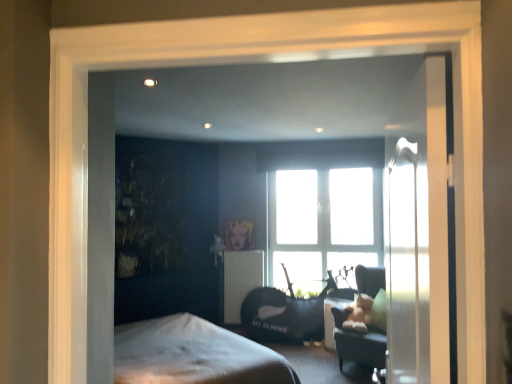
What is the approximate width of velvet black swivel chair at center, acting as the 1th swivel chair starting from the back?

velvet black swivel chair at center, acting as the 1th swivel chair starting from the back, is 24.85 centimeters wide.

Image resolution: width=512 pixels, height=384 pixels. Identify the location of clear glass door at right. (420, 239).

Locate an element on the screen. The image size is (512, 384). white textured radiator at center is located at coordinates (241, 280).

Identify the location of velvet dark gray swivel chair at center, which ranks as the first swivel chair in front-to-back order. This screenshot has height=384, width=512. (359, 346).

Is matte black table at lower center surrounded by velvet dark gray swivel chair at center, which ranks as the first swivel chair in front-to-back order?

That's incorrect, matte black table at lower center is not inside velvet dark gray swivel chair at center, which ranks as the first swivel chair in front-to-back order.

Looking at this image, is velvet dark gray swivel chair at center, positioned as the second swivel chair in back-to-front order, oriented away from matte black table at lower center?

velvet dark gray swivel chair at center, positioned as the second swivel chair in back-to-front order, is not turned away from matte black table at lower center.

Based on the photo, is velvet dark gray swivel chair at center, positioned as the second swivel chair in back-to-front order, to the left or to the right of matte black table at lower center in the image?

In the image, velvet dark gray swivel chair at center, positioned as the second swivel chair in back-to-front order, appears on the right side of matte black table at lower center.

Are velvet dark gray swivel chair at center, which ranks as the first swivel chair in front-to-back order, and matte black table at lower center beside each other?

No, velvet dark gray swivel chair at center, which ranks as the first swivel chair in front-to-back order, is not making contact with matte black table at lower center.

Between velvet black swivel chair at center, the second swivel chair viewed from the front, and metallic gold picture frame at center, which one has more height?

Standing taller between the two is velvet black swivel chair at center, the second swivel chair viewed from the front.

From a real-world perspective, is velvet black swivel chair at center, acting as the 1th swivel chair starting from the back, positioned over metallic gold picture frame at center based on gravity?

No, from a real-world perspective, velvet black swivel chair at center, acting as the 1th swivel chair starting from the back, is not on top of metallic gold picture frame at center.

Would you consider velvet black swivel chair at center, the second swivel chair viewed from the front, to be distant from metallic gold picture frame at center?

No, there isn't a large distance between velvet black swivel chair at center, the second swivel chair viewed from the front, and metallic gold picture frame at center.

From the image's perspective, is white textured radiator at center located above matte black table at lower center?

Yes.

How much distance is there between white textured radiator at center and matte black table at lower center?

They are 1.24 meters apart.

Looking at this image, from a real-world perspective, who is located higher, white textured radiator at center or matte black table at lower center?

white textured radiator at center, from a real-world perspective.

Which object is wider, matte black table at lower center or metallic gold picture frame at center?

With larger width is matte black table at lower center.

Would you say matte black table at lower center is a long distance from metallic gold picture frame at center?

Yes, matte black table at lower center and metallic gold picture frame at center are located far from each other.

Could metallic gold picture frame at center be considered to be inside matte black table at lower center?

No, metallic gold picture frame at center is located outside of matte black table at lower center.

From the image's perspective, is matte black table at lower center above metallic gold picture frame at center?

No, from the image's perspective, matte black table at lower center is not on top of metallic gold picture frame at center.

How different are the orientations of velvet black swivel chair at center, acting as the 1th swivel chair starting from the back, and clear glass door at right in degrees?

98 degrees.

Is point (313, 303) farther from viewer compared to point (426, 273)?

Yes.

Consider the image. Would you say velvet black swivel chair at center, acting as the 1th swivel chair starting from the back, is to the left or to the right of clear glass door at right in the picture?

Clearly, velvet black swivel chair at center, acting as the 1th swivel chair starting from the back, is on the right of clear glass door at right in the image.

From the image's perspective, which object appears higher, metallic gold picture frame at center or velvet black swivel chair at center, the second swivel chair viewed from the front?

metallic gold picture frame at center is shown above in the image.

Which is more to the right, metallic gold picture frame at center or velvet black swivel chair at center, acting as the 1th swivel chair starting from the back?

Positioned to the right is velvet black swivel chair at center, acting as the 1th swivel chair starting from the back.

Is metallic gold picture frame at center completely or partially outside of velvet black swivel chair at center, the second swivel chair viewed from the front?

Indeed, metallic gold picture frame at center is completely outside velvet black swivel chair at center, the second swivel chair viewed from the front.

Is metallic gold picture frame at center not near velvet black swivel chair at center, the second swivel chair viewed from the front?

No, metallic gold picture frame at center is not far away from velvet black swivel chair at center, the second swivel chair viewed from the front.

Can you confirm if velvet black swivel chair at center, acting as the 1th swivel chair starting from the back, is thinner than velvet dark gray swivel chair at center, positioned as the second swivel chair in back-to-front order?

Indeed, velvet black swivel chair at center, acting as the 1th swivel chair starting from the back, has a lesser width compared to velvet dark gray swivel chair at center, positioned as the second swivel chair in back-to-front order.

Does velvet black swivel chair at center, the second swivel chair viewed from the front, touch velvet dark gray swivel chair at center, positioned as the second swivel chair in back-to-front order?

No, velvet black swivel chair at center, the second swivel chair viewed from the front, is not next to velvet dark gray swivel chair at center, positioned as the second swivel chair in back-to-front order.

Could you tell me if velvet black swivel chair at center, acting as the 1th swivel chair starting from the back, is facing velvet dark gray swivel chair at center, which ranks as the first swivel chair in front-to-back order?

Yes.

Would you say velvet black swivel chair at center, the second swivel chair viewed from the front, is to the left or to the right of velvet dark gray swivel chair at center, which ranks as the first swivel chair in front-to-back order, in the picture?

velvet black swivel chair at center, the second swivel chair viewed from the front, is positioned on velvet dark gray swivel chair at center, which ranks as the first swivel chair in front-to-back order,'s left side.

Image resolution: width=512 pixels, height=384 pixels. I want to click on table behind the velvet dark gray swivel chair at center, which ranks as the first swivel chair in front-to-back order, so click(332, 319).

This screenshot has height=384, width=512. I want to click on the 1st swivel chair in front of the metallic gold picture frame at center, so click(287, 314).

Looking at the image, which one is located further to velvet dark gray swivel chair at center, positioned as the second swivel chair in back-to-front order, transparent glass window at center or metallic gold picture frame at center?

Based on the image, metallic gold picture frame at center appears to be further to velvet dark gray swivel chair at center, positioned as the second swivel chair in back-to-front order.

Considering their positions, is matte black table at lower center positioned closer to velvet dark gray swivel chair at center, which ranks as the first swivel chair in front-to-back order, than velvet black swivel chair at center, the second swivel chair viewed from the front?

matte black table at lower center.

Considering their positions, is metallic gold picture frame at center positioned closer to velvet dark gray swivel chair at center, which ranks as the first swivel chair in front-to-back order, than clear glass door at right?

The object closer to velvet dark gray swivel chair at center, which ranks as the first swivel chair in front-to-back order, is metallic gold picture frame at center.

Looking at the image, which one is located closer to metallic gold picture frame at center, velvet black swivel chair at center, acting as the 1th swivel chair starting from the back, or matte black table at lower center?

velvet black swivel chair at center, acting as the 1th swivel chair starting from the back, is positioned closer to the anchor metallic gold picture frame at center.

Looking at the image, which one is located closer to metallic gold picture frame at center, matte black table at lower center or white textured radiator at center?

white textured radiator at center lies closer to metallic gold picture frame at center than the other object.

Estimate the real-world distances between objects in this image. Which object is closer to white textured radiator at center, clear glass door at right or matte black table at lower center?

matte black table at lower center is closer to white textured radiator at center.

Which object lies further to the anchor point clear glass door at right, transparent glass window at center or matte black table at lower center?

transparent glass window at center is positioned further to the anchor clear glass door at right.

Based on the photo, from the image, which object appears to be farther from clear glass door at right, matte black table at lower center or velvet black swivel chair at center, acting as the 1th swivel chair starting from the back?

velvet black swivel chair at center, acting as the 1th swivel chair starting from the back.

Locate an element on the screen. The image size is (512, 384). radiator between metallic gold picture frame at center and transparent glass window at center from left to right is located at coordinates (241, 280).

This screenshot has height=384, width=512. I want to click on table located between clear glass door at right and metallic gold picture frame at center in the depth direction, so [x=332, y=319].

Locate an element on the screen. The image size is (512, 384). window between metallic gold picture frame at center and matte black table at lower center in the horizontal direction is located at coordinates (323, 207).

What are the coordinates of `swivel chair located between velvet dark gray swivel chair at center, positioned as the second swivel chair in back-to-front order, and white textured radiator at center in the depth direction` in the screenshot? It's located at (287, 314).